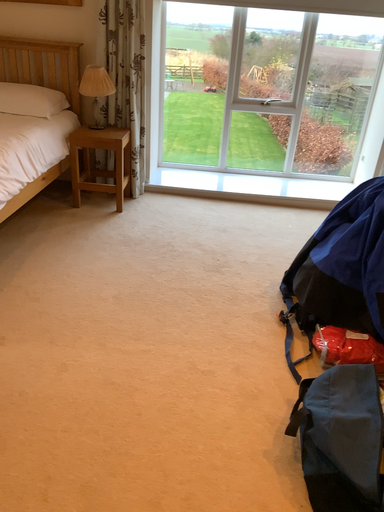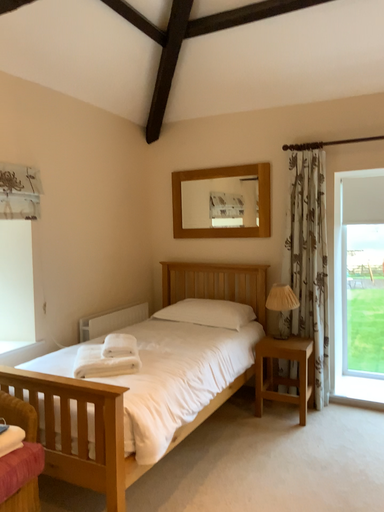
Question: Which way did the camera rotate in the video?

Choices:
 (A) rotated downward
 (B) rotated upward

Answer: (B)